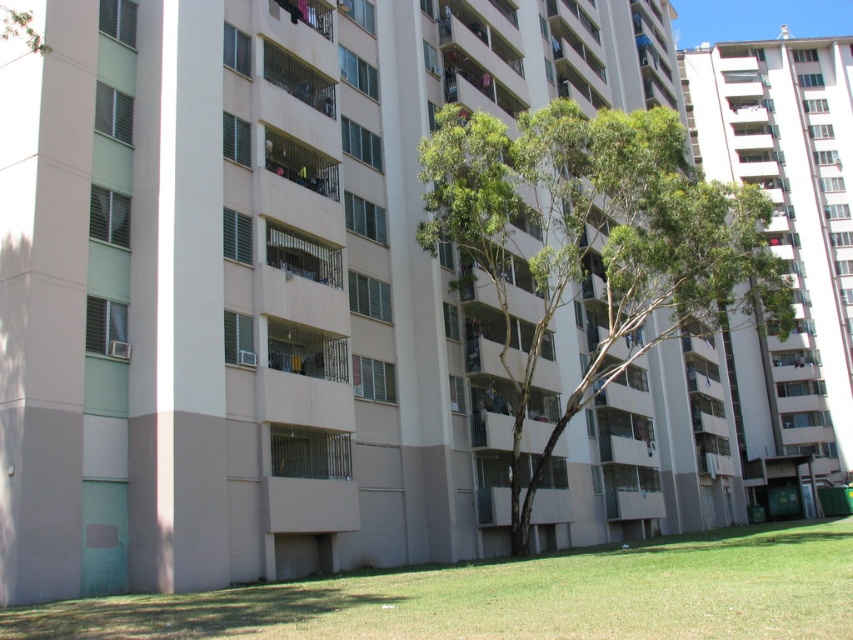
Who is lower down, green leafy tree at center or green grass at lower center?

green grass at lower center is below.

Is point (712, 272) positioned behind point (723, 632)?

Yes, it is behind point (723, 632).

Image resolution: width=853 pixels, height=640 pixels. What are the coordinates of `green leafy tree at center` in the screenshot? It's located at (596, 241).